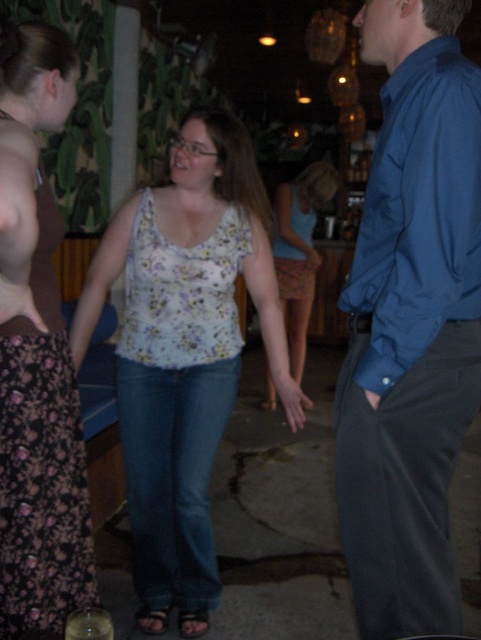
You are at a social event and see two people wearing floral patterns. The first is wearing a floral fabric dress at left, and the second is wearing a floral fabric top at center. Which person is shorter?

The floral fabric dress at left is shorter in height compared to the floral fabric top at center.

What object is located at the coordinates point (181,292) in the image?

The point (181,292) corresponds to the floral fabric tank top at center.